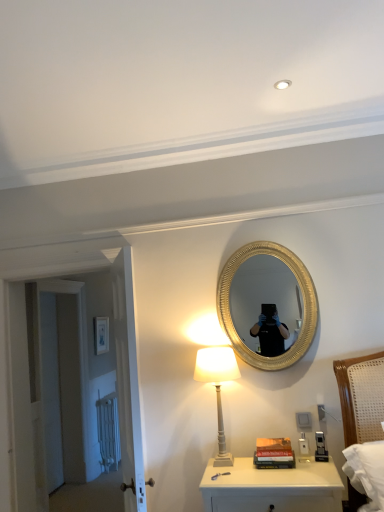
Question: Is white painted wood table lamp at lower center taller than white matte door at left, the 1th door when ordered from back to front?

Choices:
 (A) yes
 (B) no

Answer: (B)

Question: Is white matte door at left, the 1th door when ordered from back to front, inside white painted wood table lamp at lower center?

Choices:
 (A) no
 (B) yes

Answer: (A)

Question: Is white painted wood table lamp at lower center closer to camera compared to white matte door at left, the 1th door when ordered from back to front?

Choices:
 (A) yes
 (B) no

Answer: (A)

Question: Is white painted wood table lamp at lower center oriented towards white matte door at left, the 1th door when ordered from back to front?

Choices:
 (A) no
 (B) yes

Answer: (A)

Question: Does white painted wood table lamp at lower center have a larger size compared to white matte door at left, the second door from the front?

Choices:
 (A) no
 (B) yes

Answer: (A)

Question: Is white painted wood table lamp at lower center not within white matte door at left, the second door from the front?

Choices:
 (A) yes
 (B) no

Answer: (A)

Question: Is white painted wood table lamp at lower center turned away from matte white picture frame at upper left?

Choices:
 (A) yes
 (B) no

Answer: (B)

Question: From the image's perspective, is white painted wood table lamp at lower center beneath matte white picture frame at upper left?

Choices:
 (A) yes
 (B) no

Answer: (B)

Question: Does white painted wood table lamp at lower center appear on the left side of matte white picture frame at upper left?

Choices:
 (A) no
 (B) yes

Answer: (A)

Question: Is white painted wood table lamp at lower center directly adjacent to matte white picture frame at upper left?

Choices:
 (A) no
 (B) yes

Answer: (A)

Question: Can you confirm if white painted wood table lamp at lower center is bigger than matte white picture frame at upper left?

Choices:
 (A) no
 (B) yes

Answer: (B)

Question: Would you consider white painted wood table lamp at lower center to be distant from matte white picture frame at upper left?

Choices:
 (A) no
 (B) yes

Answer: (B)

Question: Considering the relative sizes of white glossy nightstand at lower center and white painted wood table lamp at lower center in the image provided, is white glossy nightstand at lower center bigger than white painted wood table lamp at lower center?

Choices:
 (A) no
 (B) yes

Answer: (B)